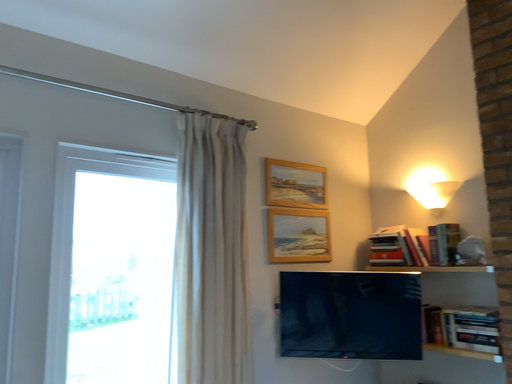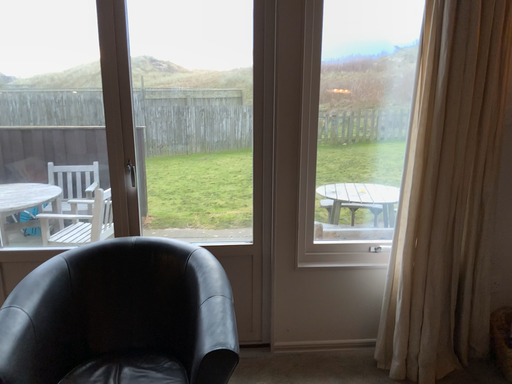
Question: Which way did the camera rotate in the video?

Choices:
 (A) rotated upward
 (B) rotated downward

Answer: (B)